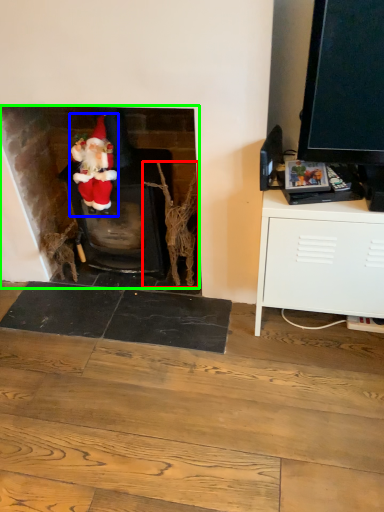
Question: Which object is positioned farthest from branch (highlighted by a red box)? Select from person (highlighted by a blue box) and fireplace (highlighted by a green box).

Choices:
 (A) person
 (B) fireplace

Answer: (B)